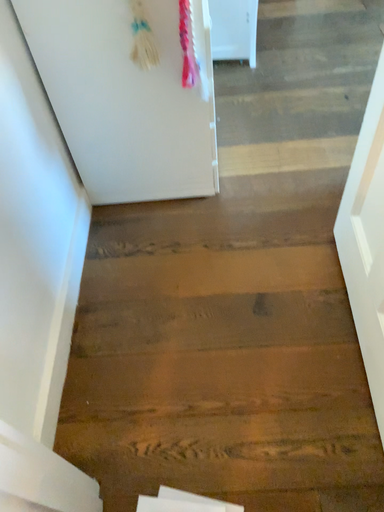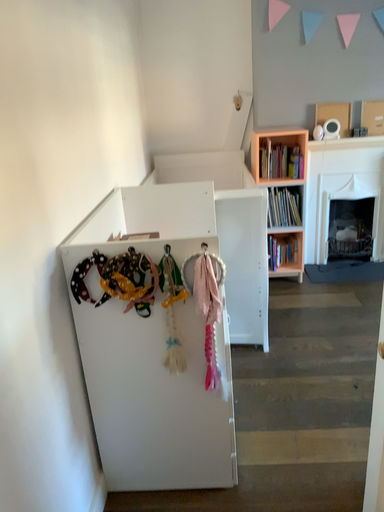
Question: How did the camera likely rotate when shooting the video?

Choices:
 (A) rotated upward
 (B) rotated downward

Answer: (A)